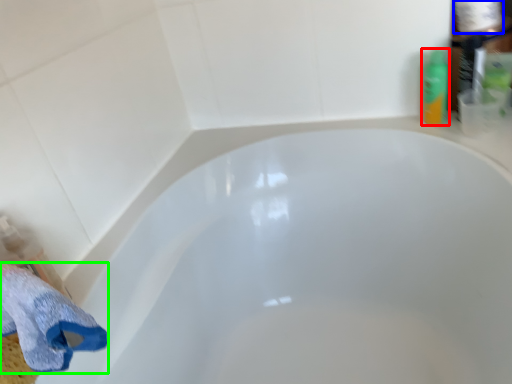
Question: Based on their relative distances, which object is farther from toiletry (highlighted by a red box)? Choose from toilet paper (highlighted by a blue box) and bath towel (highlighted by a green box).

Choices:
 (A) toilet paper
 (B) bath towel

Answer: (B)